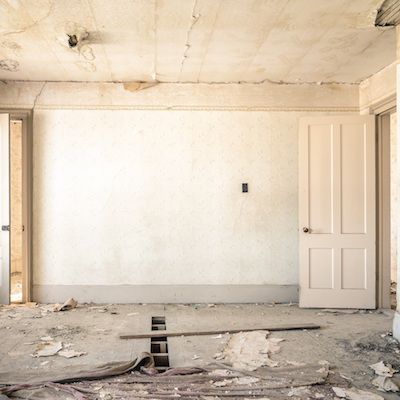
At what (x,y) coordinates should I click in order to perform the action: click on doorknobs. Please return your answer as a coordinate pair (x, y). The image size is (400, 400). Looking at the image, I should click on (306, 230), (4, 229).